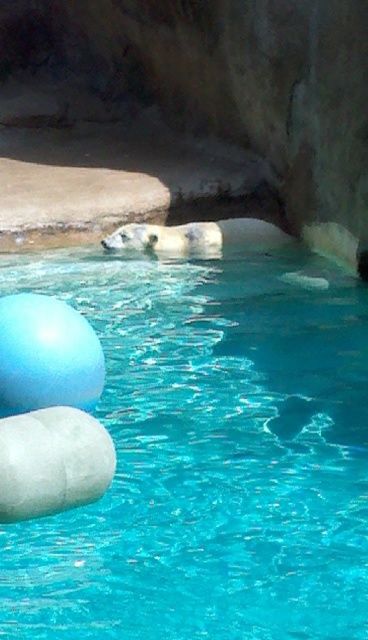
Between transparent blue water at upper center and white fur polar bear at center, which one has more height?

With more height is white fur polar bear at center.

Does transparent blue water at upper center come behind white fur polar bear at center?

No, it is in front of white fur polar bear at center.

Which is behind, point (312, 490) or point (182, 227)?

The point (182, 227) is more distant.

What are the coordinates of `transparent blue water at upper center` in the screenshot? It's located at (207, 454).